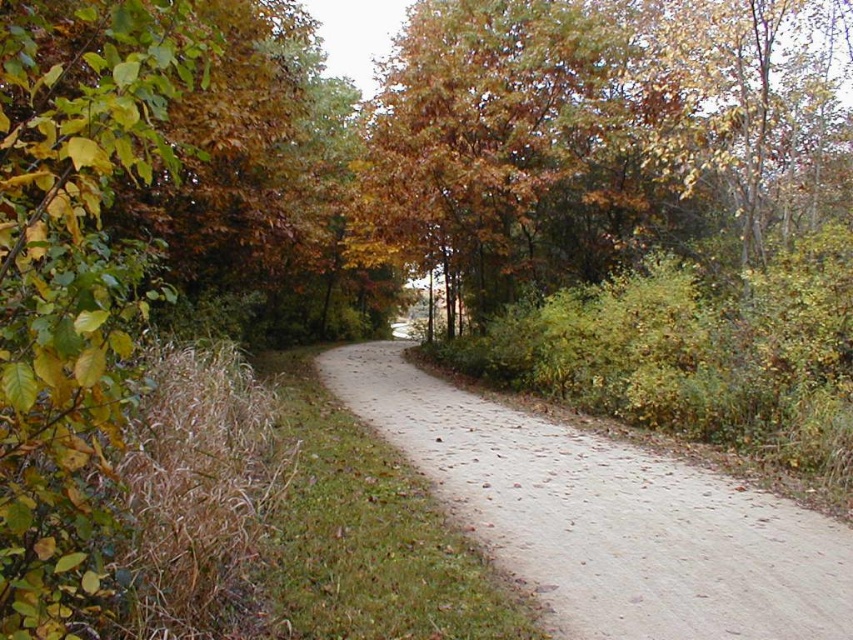
Who is taller, dirt/gravel path at center or autumn leaves at upper center?

With more height is autumn leaves at upper center.

Which is above, dirt/gravel path at center or autumn leaves at upper center?

autumn leaves at upper center

Find the location of a particular element. dirt/gravel path at center is located at coordinates (606, 515).